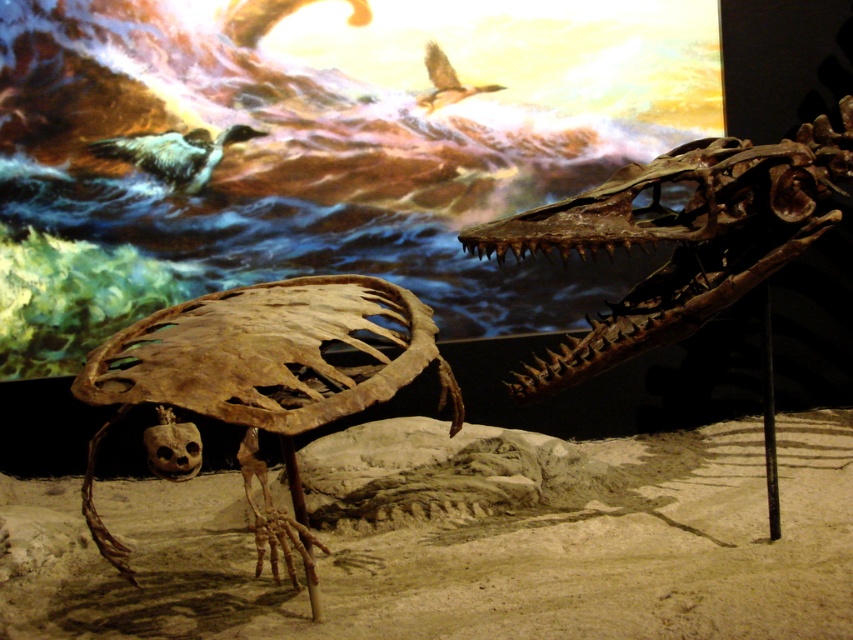
Question: Which object appears closest to the camera in this image?

Choices:
 (A) brown feathered bird at upper center
 (B) white feathered bird at upper left
 (C) brown bone fossil at lower left
 (D) brown bone skull at upper right

Answer: (C)

Question: Which of the following is the farthest from the observer?

Choices:
 (A) brown bone skull at upper right
 (B) brown feathered bird at upper center
 (C) white feathered bird at upper left
 (D) brown bone fossil at lower left

Answer: (B)

Question: Is white feathered bird at upper left above brown feathered bird at upper center?

Choices:
 (A) no
 (B) yes

Answer: (A)

Question: Which point is farther to the camera?

Choices:
 (A) (270, 509)
 (B) (430, 45)
 (C) (163, 148)

Answer: (B)

Question: Is brown bone fossil at lower left above white feathered bird at upper left?

Choices:
 (A) yes
 (B) no

Answer: (B)

Question: Does brown bone fossil at lower left appear under brown feathered bird at upper center?

Choices:
 (A) no
 (B) yes

Answer: (B)